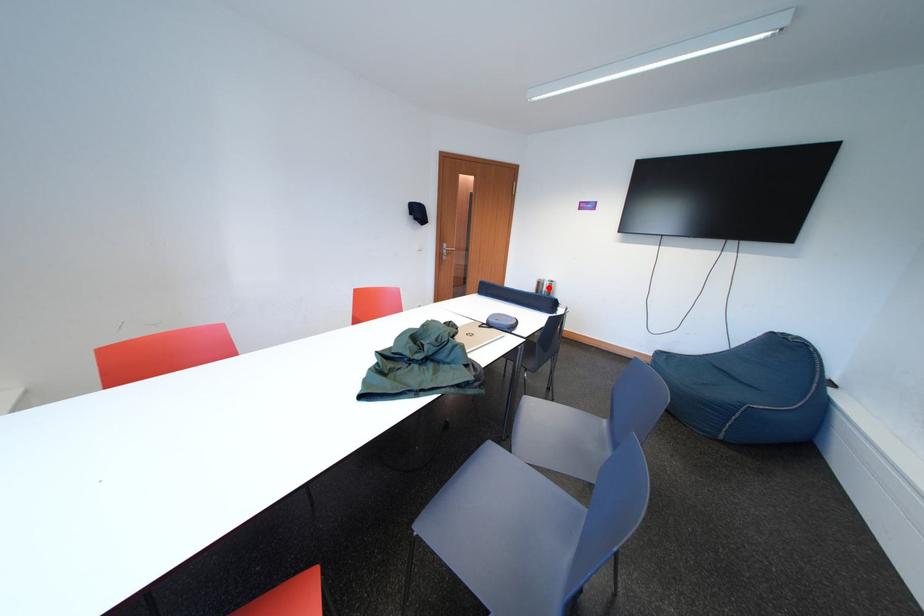
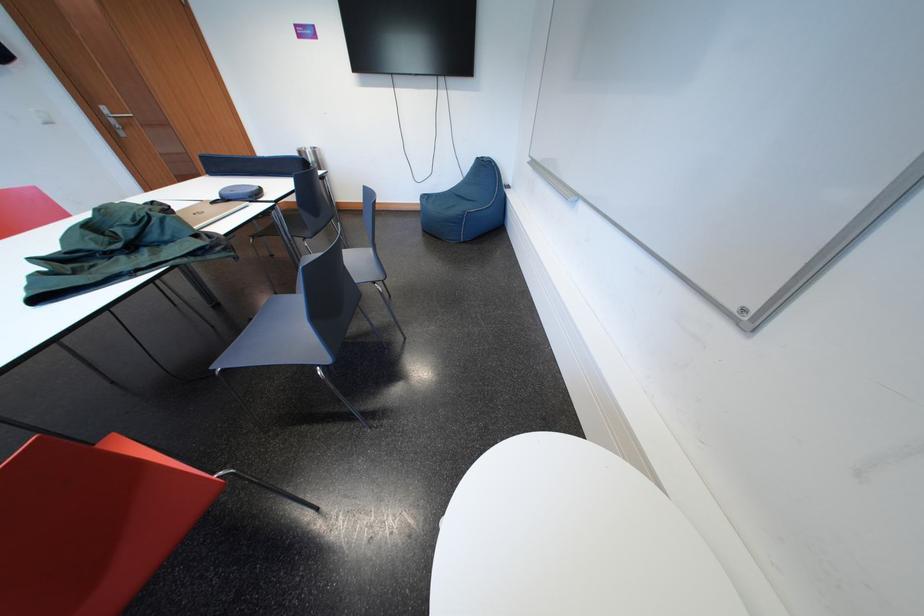
Find the pixel in the second image that matches the highlighted location in the first image.

(310, 158)